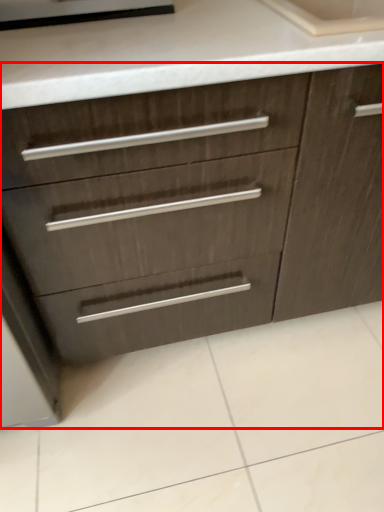
Question: Where is chest of drawers (annotated by the red box) located in relation to appliance in the image?

Choices:
 (A) right
 (B) left

Answer: (A)